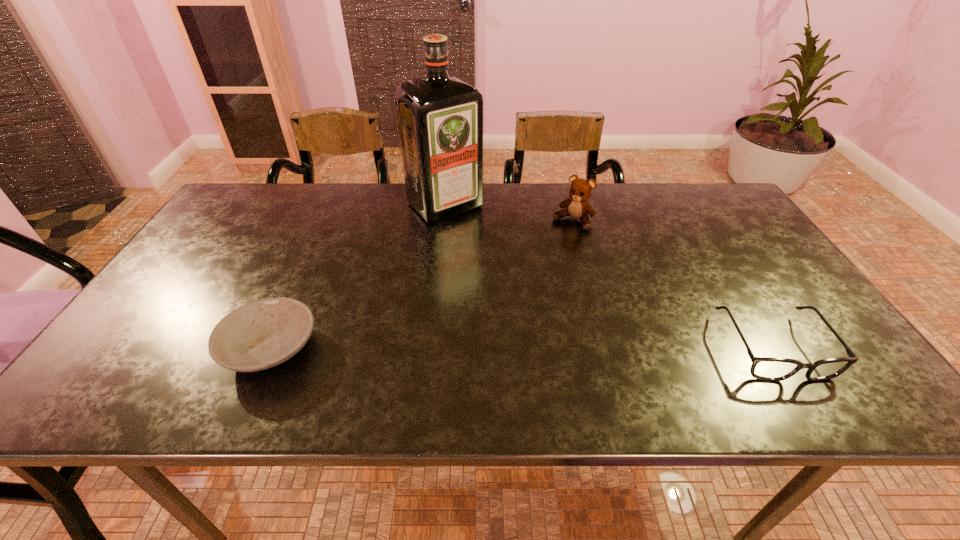
Locate an element on the screen. Image resolution: width=960 pixels, height=540 pixels. vacant region located on the front-facing side of the second tallest object is located at coordinates pos(541,260).

Locate an element on the screen. vacant space located 0.400m on the front-facing side of the second tallest object is located at coordinates (498, 315).

The image size is (960, 540). Find the location of `vacant space located on the front-facing side of the second tallest object`. vacant space located on the front-facing side of the second tallest object is located at coordinates (554, 244).

You are a GUI agent. You are given a task and a screenshot of the screen. Output one action in this format:
    pyautogui.click(x=<x>, y=<y>)
    Task: Click on the liquor situated at the far edge
    The image size is (960, 540).
    Given the screenshot: What is the action you would take?
    pyautogui.click(x=440, y=118)

Find the location of a particular element. teddy bear positioned at the far edge is located at coordinates (577, 206).

Find the location of `bowl present at the near edge`. bowl present at the near edge is located at coordinates (262, 334).

Image resolution: width=960 pixels, height=540 pixels. What are the coordinates of `spectacles that is at the near edge` in the screenshot? It's located at (763, 368).

Find the location of a particular element. This screenshot has width=960, height=540. object present at the right edge is located at coordinates (763, 368).

Identify the location of object at the near right corner. (763, 368).

Locate an element on the screen. This screenshot has height=540, width=960. vacant space at the far edge is located at coordinates (521, 204).